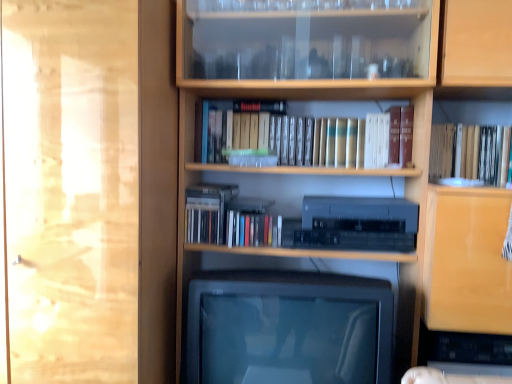
Find the location of a particular element. matte black television at center is located at coordinates (288, 328).

Describe the element at coordinates (71, 189) in the screenshot. I see `transparent glass door at left` at that location.

In order to face satin black stereo at center, should I rotate leftwards or rightwards?

Rotate your view right by about 11.984°.

You are a GUI agent. You are given a task and a screenshot of the screen. Output one action in this format:
    pyautogui.click(x=<x>, y=<y>)
    Task: Click on the hardcover book at upper right
    The width and height of the screenshot is (512, 384).
    Given the screenshot: What is the action you would take?
    pyautogui.click(x=470, y=152)

Is satin black stereo at center at the back of matte black television at center?

No, satin black stereo at center is not at the back of matte black television at center.

Would you say matte black television at center is outside satin black stereo at center?

matte black television at center lies outside satin black stereo at center's area.

Locate an element on the screen. This screenshot has height=384, width=512. television that appears on the left of satin black stereo at center is located at coordinates (288, 328).

Considering the relative sizes of transparent glass door at left and wooden bookcase at center in the image provided, is transparent glass door at left wider than wooden bookcase at center?

Incorrect, the width of transparent glass door at left does not surpass that of wooden bookcase at center.

Considering the relative sizes of transparent glass door at left and wooden bookcase at center in the image provided, is transparent glass door at left bigger than wooden bookcase at center?

No, transparent glass door at left is not bigger than wooden bookcase at center.

From a real-world perspective, which is physically below, transparent glass door at left or wooden bookcase at center?

transparent glass door at left, from a real-world perspective.

Is transparent glass door at left facing away from wooden bookcase at center?

No, transparent glass door at left's orientation is not away from wooden bookcase at center.

Is wooden bookcase at center taller than transparent glass door at left?

Yes.

Between wooden bookcase at center and transparent glass door at left, which one has smaller size?

transparent glass door at left is smaller.

In the scene shown: From the image's perspective, between wooden bookcase at center and transparent glass door at left, which one is located above?

From the image's view, wooden bookcase at center is above.

Locate an element on the screen. This screenshot has height=384, width=512. book above the transparent glass door at left (from a real-world perspective) is located at coordinates (470, 152).

Does transparent glass door at left turn towards hardcover book at upper right?

No, transparent glass door at left is not turned towards hardcover book at upper right.

Which object is positioned more to the right, transparent glass door at left or hardcover book at upper right?

hardcover book at upper right.

How far apart are transparent glass door at left and hardcover book at upper right?

transparent glass door at left and hardcover book at upper right are 1.20 meters apart.

Looking at this image, how many degrees apart are the facing directions of satin black stereo at center and matte black television at center?

2.31 degrees.

Considering the relative positions of satin black stereo at center and matte black television at center in the image provided, is satin black stereo at center to the left or to the right of matte black television at center?

Clearly, satin black stereo at center is on the right of matte black television at center in the image.

Which of these two, satin black stereo at center or matte black television at center, is thinner?

satin black stereo at center.

Is there a large distance between satin black stereo at center and hardcover book at upper right?

No.

Is the depth of satin black stereo at center less than that of hardcover book at upper right?

Yes, satin black stereo at center is in front of hardcover book at upper right.

Between point (351, 242) and point (448, 170), which one is positioned behind?

The point (448, 170) is behind.

Considering the relative sizes of satin black stereo at center and hardcover book at upper right in the image provided, is satin black stereo at center thinner than hardcover book at upper right?

In fact, satin black stereo at center might be wider than hardcover book at upper right.

I want to click on glass door above the satin black stereo at center (from the image's perspective), so click(71, 189).

Does satin black stereo at center have a lesser width compared to transparent glass door at left?

Yes.

From a real-world perspective, is satin black stereo at center located higher than transparent glass door at left?

No, from a real-world perspective, satin black stereo at center is not over transparent glass door at left

In terms of size, does satin black stereo at center appear bigger or smaller than transparent glass door at left?

satin black stereo at center is smaller than transparent glass door at left.

Where is `television that appears below the satin black stereo at center (from a real-world perspective)`? This screenshot has height=384, width=512. television that appears below the satin black stereo at center (from a real-world perspective) is located at coordinates (288, 328).

Locate an element on the screen. The image size is (512, 384). bookcase that appears on the right of transparent glass door at left is located at coordinates (347, 259).

Estimate the real-world distances between objects in this image. Which object is closer to hardcover book at upper right, satin black stereo at center or wooden bookcase at center?

satin black stereo at center lies closer to hardcover book at upper right than the other object.

Estimate the real-world distances between objects in this image. Which object is closer to hardcover book at upper right, matte black television at center or satin black stereo at center?

satin black stereo at center is closer to hardcover book at upper right.

Which object lies nearer to the anchor point satin black stereo at center, wooden bookcase at center or matte black television at center?

wooden bookcase at center.

From the image, which object appears to be nearer to hardcover book at upper right, satin black stereo at center or transparent glass door at left?

satin black stereo at center.

When comparing their distances from satin black stereo at center, does wooden bookcase at center or transparent glass door at left seem closer?

wooden bookcase at center is positioned closer to the anchor satin black stereo at center.

Which object lies further to the anchor point satin black stereo at center, transparent glass door at left or matte black television at center?

transparent glass door at left is further to satin black stereo at center.

Looking at the image, which one is located closer to matte black television at center, transparent glass door at left or wooden bookcase at center?

wooden bookcase at center lies closer to matte black television at center than the other object.

From the picture: Considering their positions, is wooden bookcase at center positioned closer to transparent glass door at left than satin black stereo at center?

wooden bookcase at center.

I want to click on stereo located between transparent glass door at left and hardcover book at upper right in the left-right direction, so click(358, 224).

You are a GUI agent. You are given a task and a screenshot of the screen. Output one action in this format:
    pyautogui.click(x=<x>, y=<y>)
    Task: Click on the stereo situated between transparent glass door at left and wooden bookcase at center from left to right
    This screenshot has width=512, height=384.
    Given the screenshot: What is the action you would take?
    (x=358, y=224)

Find the location of a particular element. bookcase located between transparent glass door at left and hardcover book at upper right in the left-right direction is located at coordinates (347, 259).

Image resolution: width=512 pixels, height=384 pixels. I want to click on bookcase between matte black television at center and hardcover book at upper right in the horizontal direction, so click(347, 259).